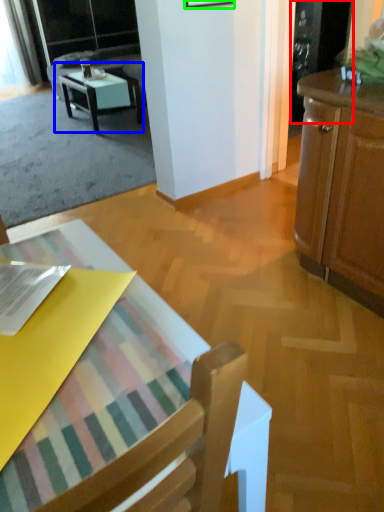
Question: Which is farther away from screen door (highlighted by a red box)? table (highlighted by a blue box) or picture frame (highlighted by a green box)?

Choices:
 (A) table
 (B) picture frame

Answer: (A)